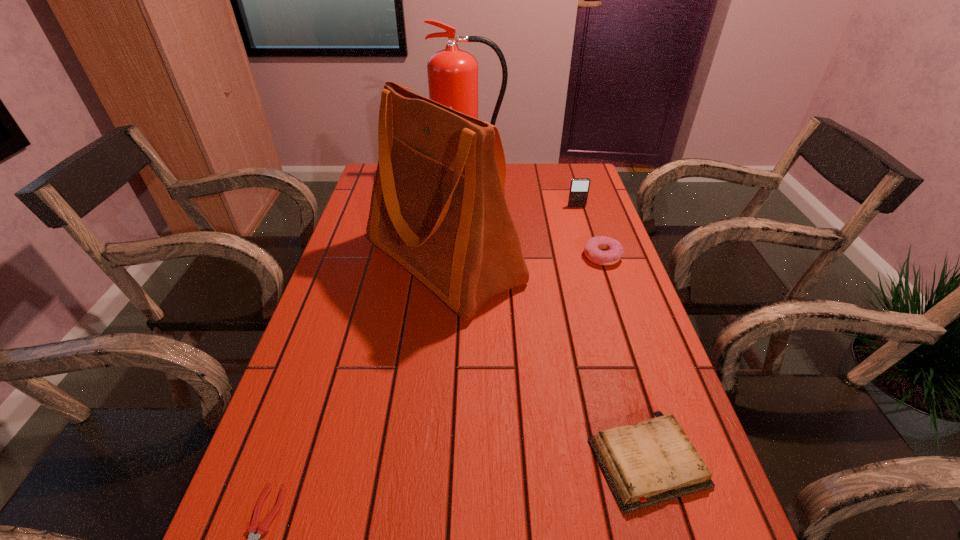
The image size is (960, 540). What are the coordinates of `vacant space located on the back of the second shortest object` in the screenshot? It's located at (628, 395).

This screenshot has height=540, width=960. I want to click on object situated at the far edge, so click(452, 72).

Locate an element on the screen. object that is at the left edge is located at coordinates (438, 208).

This screenshot has height=540, width=960. In order to click on iPod at the right edge in this screenshot , I will do `click(579, 187)`.

Identify the location of doughnut that is at the right edge. The height and width of the screenshot is (540, 960). (613, 250).

Where is `diary positioned at the right edge`? diary positioned at the right edge is located at coordinates (654, 461).

Locate an element on the screen. The width and height of the screenshot is (960, 540). free point at the left edge is located at coordinates (307, 402).

You are a GUI agent. You are given a task and a screenshot of the screen. Output one action in this format:
    pyautogui.click(x=<x>, y=<y>)
    Task: Click on the vacant region at the right edge of the desktop
    The width and height of the screenshot is (960, 540).
    Given the screenshot: What is the action you would take?
    pyautogui.click(x=684, y=534)

Where is `empty location between the diary and the farthest object`? This screenshot has width=960, height=540. empty location between the diary and the farthest object is located at coordinates (x=559, y=318).

At what (x,y) coordinates should I click in order to perform the action: click on free space that is in between the fifth tallest object and the shopping bag. Please return your answer as a coordinate pair (x, y). Looking at the image, I should click on (545, 361).